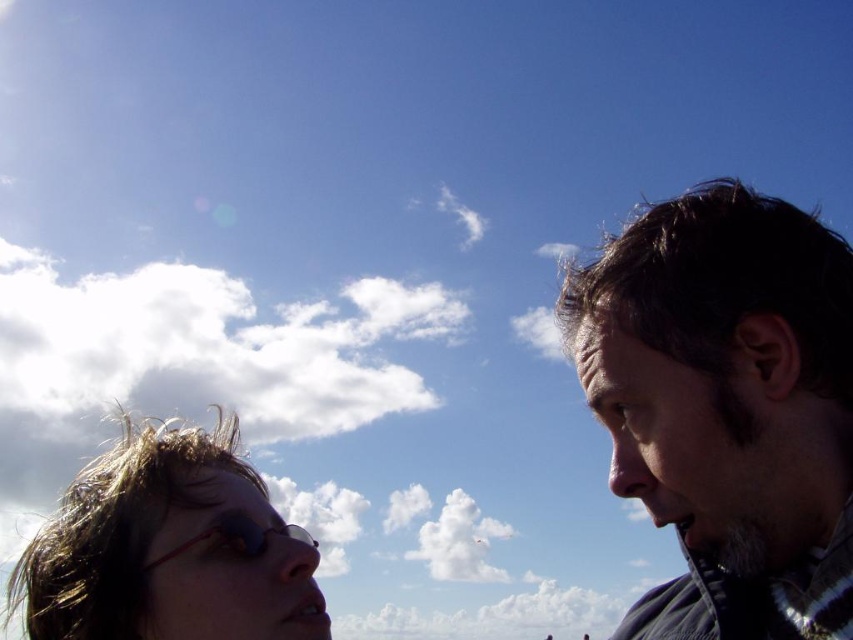
Question: Is dark brown hair at right smaller than sunglasses at lower left?

Choices:
 (A) no
 (B) yes

Answer: (B)

Question: Which point is closer to the camera taking this photo?

Choices:
 (A) (778, 282)
 (B) (190, 624)

Answer: (A)

Question: Which object appears closest to the camera in this image?

Choices:
 (A) dark brown hair at right
 (B) sunglasses at lower left

Answer: (A)

Question: Does dark brown hair at right have a larger size compared to sunglasses at lower left?

Choices:
 (A) no
 (B) yes

Answer: (A)

Question: Is dark brown hair at right to the left of sunglasses at lower left from the viewer's perspective?

Choices:
 (A) yes
 (B) no

Answer: (B)